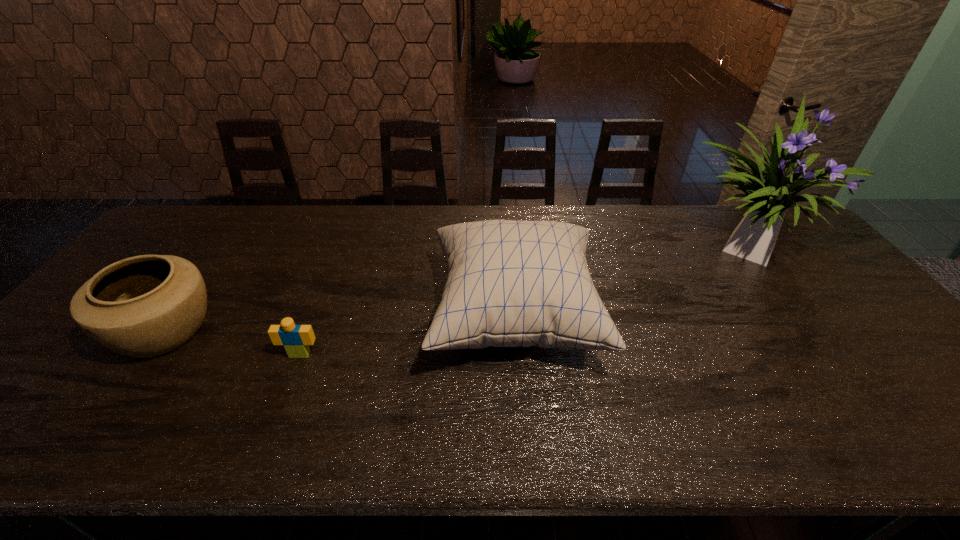
Identify the location of vacant space located on the right of the leftmost object. The image size is (960, 540). (325, 331).

Identify the location of vacant region located 0.230m on the face of the third object from right to left. (263, 450).

You are a GUI agent. You are given a task and a screenshot of the screen. Output one action in this format:
    pyautogui.click(x=<x>, y=<y>)
    Task: Click on the object positioned at the far edge
    The height and width of the screenshot is (540, 960).
    Given the screenshot: What is the action you would take?
    pyautogui.click(x=772, y=188)

Identify the location of object at the left edge. This screenshot has width=960, height=540. (143, 306).

Find the location of a particular element. object that is at the right edge is located at coordinates (772, 188).

Locate an element on the screen. object at the far right corner is located at coordinates (772, 188).

At what (x,y) coordinates should I click in order to perform the action: click on free region at the far edge of the desktop. Please return your answer as a coordinate pair (x, y). This screenshot has width=960, height=540. Looking at the image, I should click on (612, 217).

At what (x,y) coordinates should I click in order to perform the action: click on vacant space at the near edge of the desktop. Please return your answer as a coordinate pair (x, y). This screenshot has height=540, width=960. Looking at the image, I should click on (803, 440).

Image resolution: width=960 pixels, height=540 pixels. Find the location of `vacant area at the right edge of the desktop`. vacant area at the right edge of the desktop is located at coordinates (823, 270).

This screenshot has height=540, width=960. In order to click on vacant space at the far left corner of the desktop in this screenshot , I will do `click(223, 209)`.